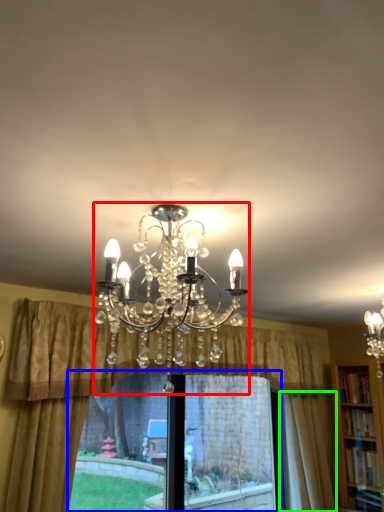
Question: Estimate the real-world distances between objects in this image. Which object is closer to lamp (highlighted by a red box), bay window (highlighted by a blue box) or curtain (highlighted by a green box)?

Choices:
 (A) bay window
 (B) curtain

Answer: (A)